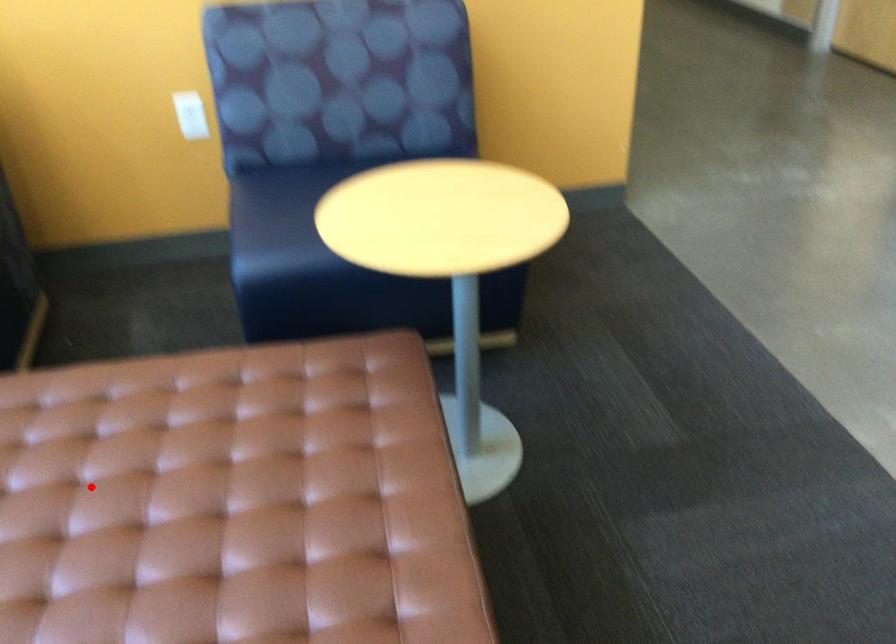
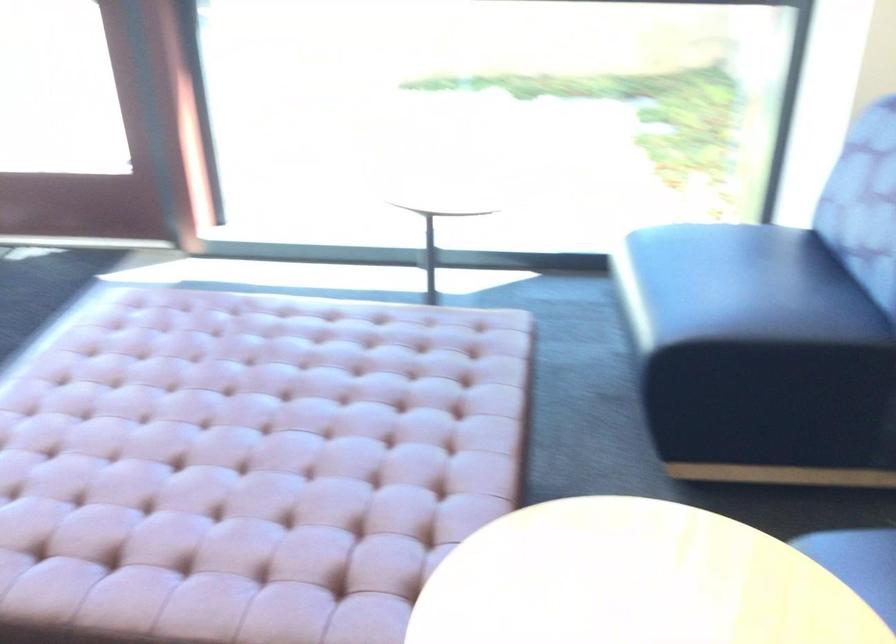
In the second image, find the point that corresponds to the highlighted location in the first image.

(306, 406)